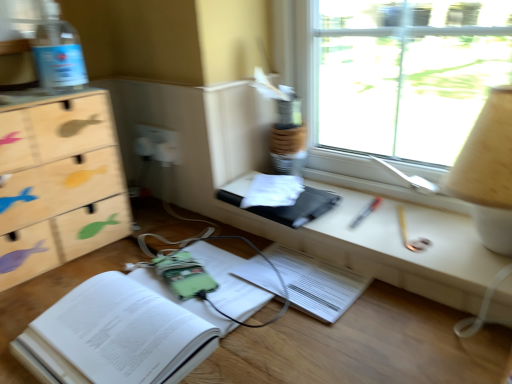
I want to click on free space in front of wooden fish-patterned chest of drawers at left, so click(45, 285).